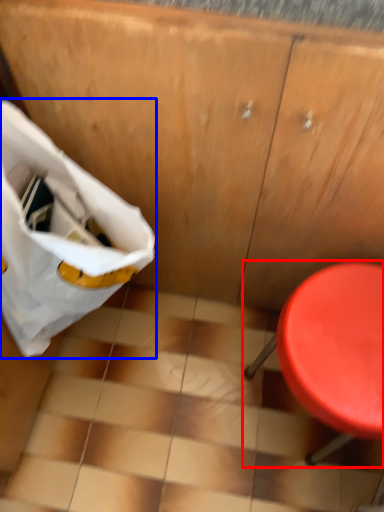
Question: Which object is closer to the camera taking this photo, furniture (highlighted by a red box) or grocery bag (highlighted by a blue box)?

Choices:
 (A) furniture
 (B) grocery bag

Answer: (B)